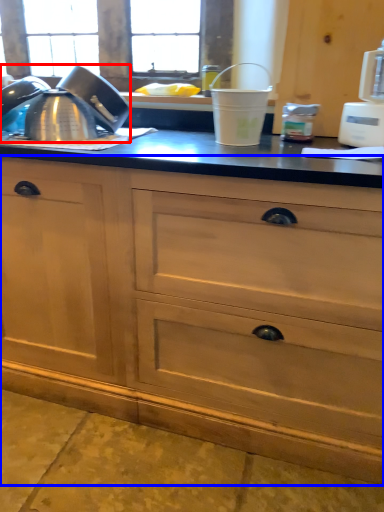
Question: Among these objects, which one is nearest to the camera, tea pot (highlighted by a red box) or cabinetry (highlighted by a blue box)?

Choices:
 (A) tea pot
 (B) cabinetry

Answer: (B)